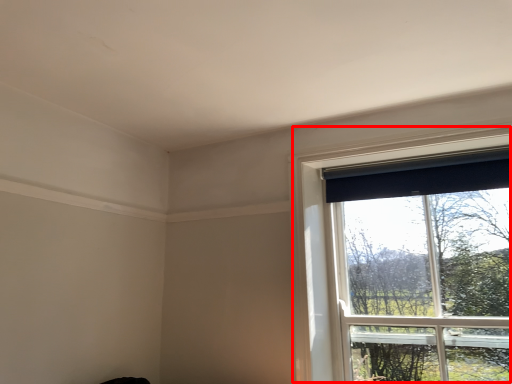
Question: From the image's perspective, considering the relative positions of window (annotated by the red box) and curtain in the image provided, where is window (annotated by the red box) located with respect to the staircase?

Choices:
 (A) above
 (B) below

Answer: (B)